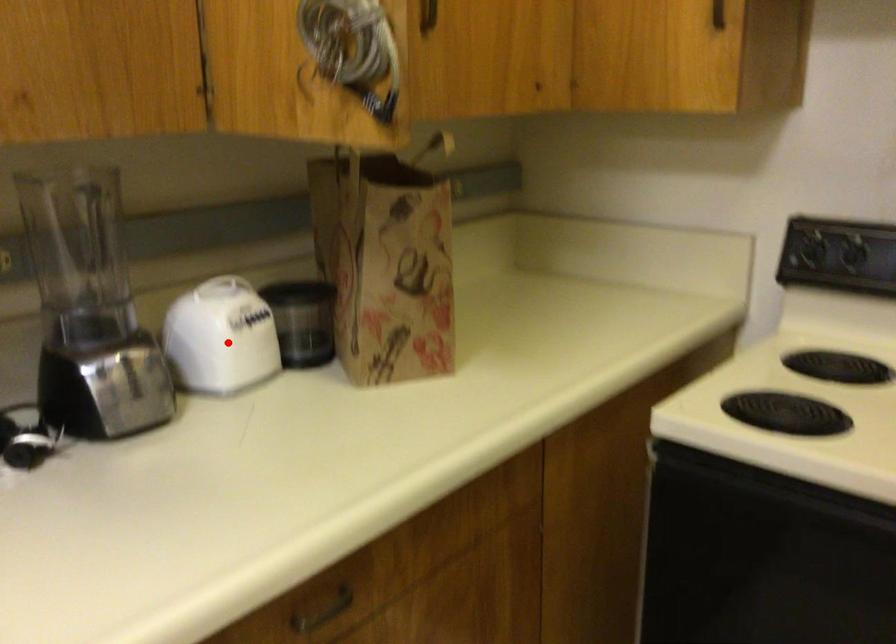
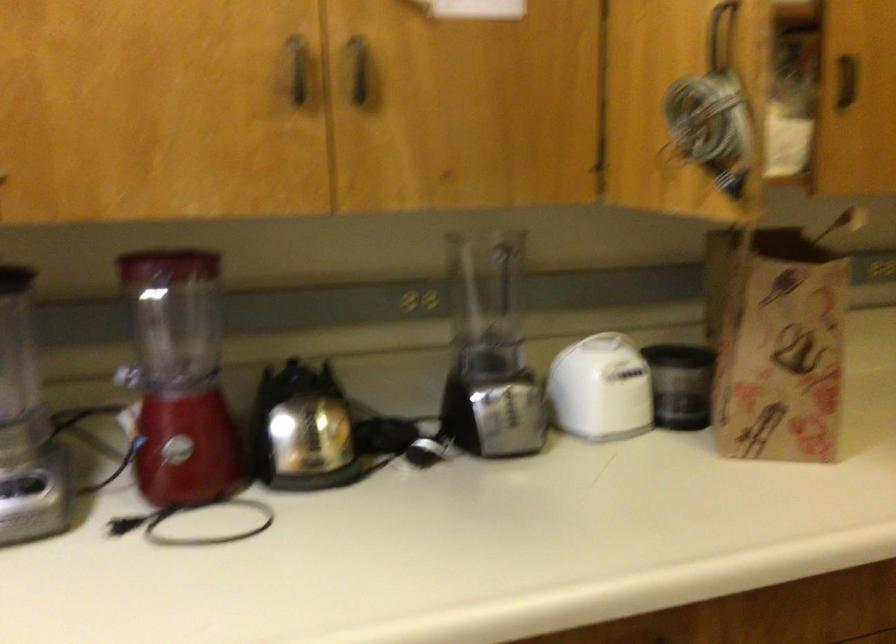
Find the pixel in the second image that matches the highlighted location in the first image.

(600, 389)